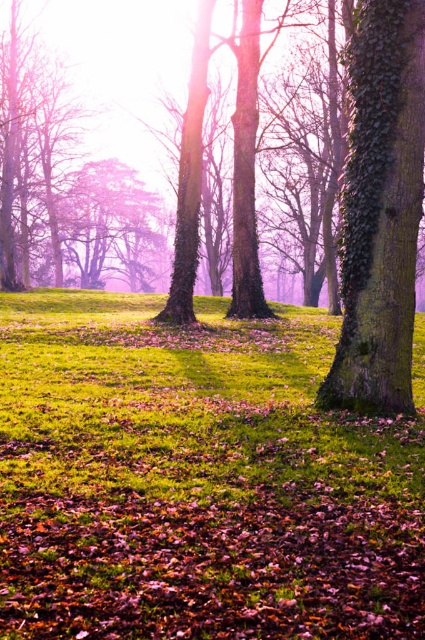
Question: Does green grassy at center lie behind green mossy tree trunk at center?

Choices:
 (A) no
 (B) yes

Answer: (A)

Question: Is green grassy at center thinner than green mossy tree trunk at center?

Choices:
 (A) no
 (B) yes

Answer: (A)

Question: Among these objects, which one is farthest from the camera?

Choices:
 (A) green grassy at center
 (B) green mossy tree trunk at center

Answer: (B)

Question: Can you confirm if green grassy at center is wider than green mossy tree trunk at center?

Choices:
 (A) yes
 (B) no

Answer: (A)